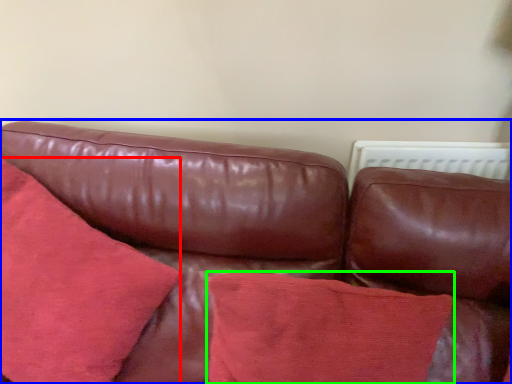
Question: Which object is the farthest from throw pillow (highlighted by a red box)? Choose among these: studio couch (highlighted by a blue box) or throw pillow (highlighted by a green box).

Choices:
 (A) studio couch
 (B) throw pillow

Answer: (B)